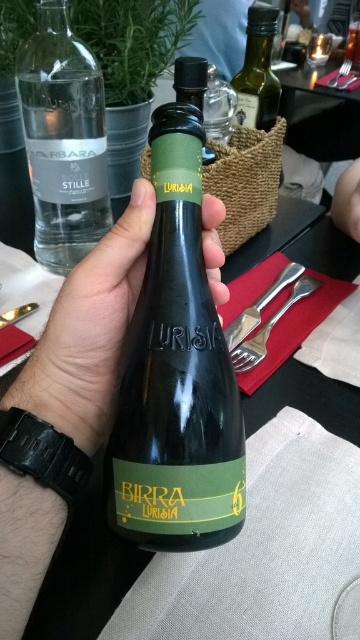
Question: Can you confirm if clear glass bottle at upper left is positioned above brushed metal fork at lower left?

Choices:
 (A) yes
 (B) no

Answer: (A)

Question: Which object appears farthest from the camera in this image?

Choices:
 (A) matte green glass bottle at center
 (B) brushed metal fork at lower left
 (C) clear glass bottle at upper center
 (D) green glass bottle at upper right

Answer: (D)

Question: Which of the following is the closest to the observer?

Choices:
 (A) matte green glass bottle at center
 (B) clear glass bottle at upper left
 (C) metallic silver fork at upper center
 (D) satin silver fork at lower right

Answer: (A)

Question: Can you confirm if brushed metal fork at lower left is positioned above metallic silver fork at upper center?

Choices:
 (A) yes
 (B) no

Answer: (B)

Question: Which of the following is the closest to the observer?

Choices:
 (A) black matte bottle at center
 (B) brushed metal fork at lower left

Answer: (A)

Question: Is clear glass bottle at upper center positioned in front of brushed metal fork at lower left?

Choices:
 (A) yes
 (B) no

Answer: (B)